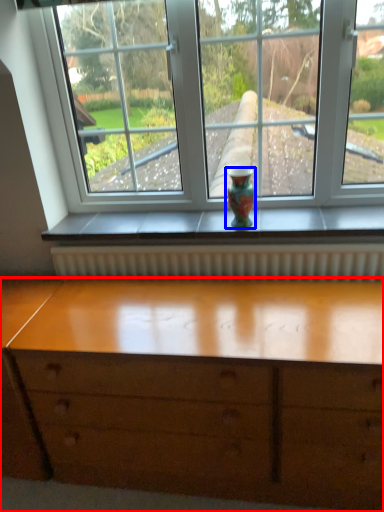
Question: Which point is closer to the camera, chest of drawers (highlighted by a red box) or glass vase (highlighted by a blue box)?

Choices:
 (A) chest of drawers
 (B) glass vase

Answer: (A)